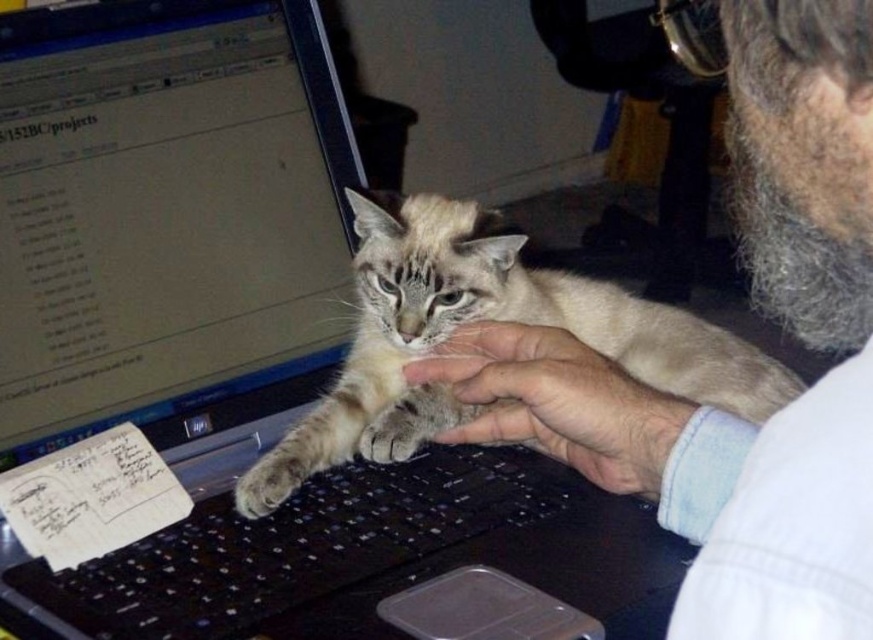
Based on the scene described, can you determine the relationship between the black plastic keyboard at center and the fur at center?

The black plastic keyboard at center is positioned under the fur at center.

Based on the photo, you are a photographer standing at a distance of 60 centimeters from the desk. You want to take a clear photo of the black plastic keyboard at center without moving the cat. Is the keyboard within your camera range?

The black plastic keyboard at center is 57.99 centimeters from camera, which is within the photographer standing at 60 centimeters distance. Therefore, the keyboard is within the camera range.

You are trying to determine the position of two points in the image. Which point is closer to you, point at coordinate (78,608) or point at coordinate (265,483)?

Point at coordinate (78,608) is closer to you than point at coordinate (265,483).